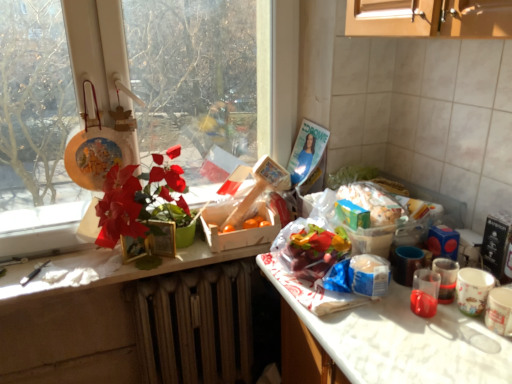
Question: Would you say transparent glass window at upper left is part of brown textured radiator at lower center's contents?

Choices:
 (A) no
 (B) yes

Answer: (A)

Question: Considering the relative sizes of brown textured radiator at lower center and transparent glass window at upper left in the image provided, is brown textured radiator at lower center thinner than transparent glass window at upper left?

Choices:
 (A) yes
 (B) no

Answer: (B)

Question: Is brown textured radiator at lower center facing away from transparent glass window at upper left?

Choices:
 (A) yes
 (B) no

Answer: (B)

Question: Is brown textured radiator at lower center taller than transparent glass window at upper left?

Choices:
 (A) yes
 (B) no

Answer: (B)

Question: Does brown textured radiator at lower center have a greater width compared to transparent glass window at upper left?

Choices:
 (A) no
 (B) yes

Answer: (B)

Question: Considering the relative sizes of brown textured radiator at lower center and transparent glass window at upper left in the image provided, is brown textured radiator at lower center shorter than transparent glass window at upper left?

Choices:
 (A) no
 (B) yes

Answer: (B)

Question: Does transparent plastic cup at lower right, the second coffee cup in the right-to-left sequence, come in front of matte plastic flower at left?

Choices:
 (A) no
 (B) yes

Answer: (B)

Question: Is transparent plastic cup at lower right, the 1th coffee cup from the left, oriented towards matte plastic flower at left?

Choices:
 (A) no
 (B) yes

Answer: (A)

Question: Considering the relative sizes of transparent plastic cup at lower right, the 1th coffee cup from the left, and matte plastic flower at left in the image provided, is transparent plastic cup at lower right, the 1th coffee cup from the left, smaller than matte plastic flower at left?

Choices:
 (A) yes
 (B) no

Answer: (A)

Question: Is transparent plastic cup at lower right, the second coffee cup in the right-to-left sequence, wider than matte plastic flower at left?

Choices:
 (A) yes
 (B) no

Answer: (B)

Question: From a real-world perspective, is transparent plastic cup at lower right, the 1th coffee cup from the left, located beneath matte plastic flower at left?

Choices:
 (A) no
 (B) yes

Answer: (B)

Question: Can you confirm if transparent plastic cup at lower right, the 1th coffee cup from the left, is thinner than matte plastic flower at left?

Choices:
 (A) yes
 (B) no

Answer: (A)

Question: Is transparent plastic cup at lower right, the 1th coffee cup from the left, further to the viewer compared to smooth wooden counter at center?

Choices:
 (A) no
 (B) yes

Answer: (A)